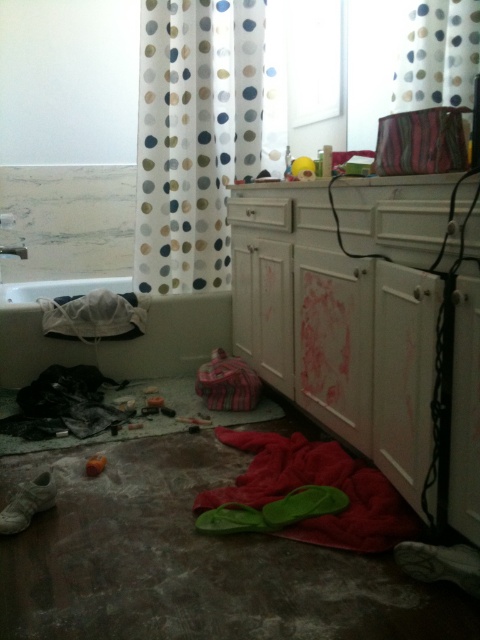
You are trying to determine the relative heights of the objects in the bathroom. Which object is taller between the white glossy vanity at lower right and the white dotted fabric at upper center?

The white glossy vanity at lower right is taller than the white dotted fabric at upper center according to the description.

You are standing in the bathroom and notice two fabrics at the upper center area. Which one is closer to you, the polka dot fabric shower curtain at upper center or the white dotted fabric at upper center?

The polka dot fabric shower curtain at upper center is closer to you because it is further to the viewer than the white dotted fabric at upper center.